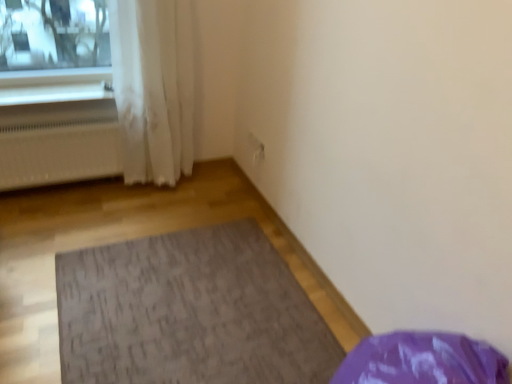
What are the coordinates of `spots to the right of white sheer curtain at left` in the screenshot? It's located at (210, 189).